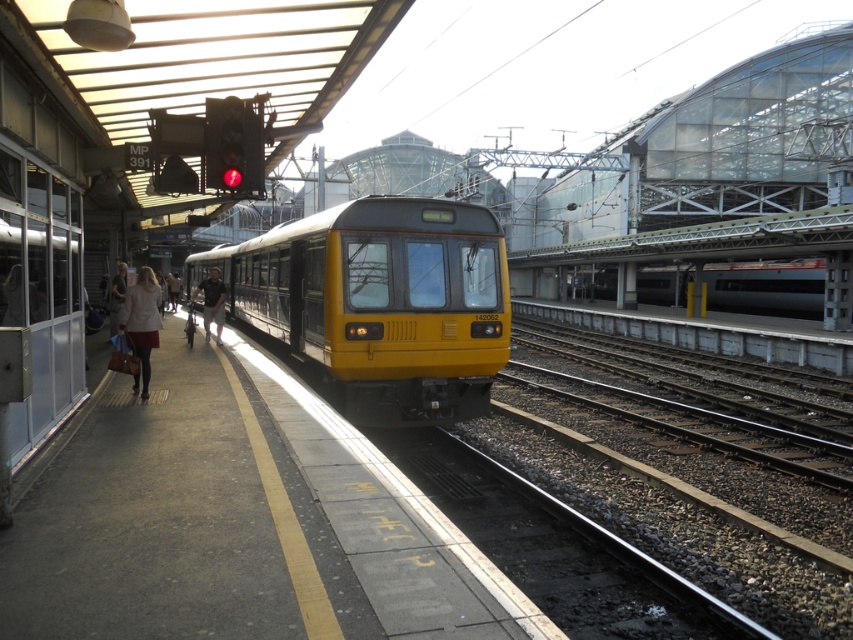
Question: Is silver metallic train at center above dark gray pants at left?

Choices:
 (A) yes
 (B) no

Answer: (A)

Question: Does yellow matte train at center appear on the right side of silver metallic train at center?

Choices:
 (A) no
 (B) yes

Answer: (A)

Question: Is yellow matte train at center bigger than matte beige jacket at left?

Choices:
 (A) yes
 (B) no

Answer: (A)

Question: Which object is the closest to the yellow matte train at center?

Choices:
 (A) dark gray pants at left
 (B) silver metallic train at center
 (C) matte beige jacket at left

Answer: (A)

Question: Which is nearer to the yellow matte train at center?

Choices:
 (A) silver metallic train at center
 (B) matte beige jacket at left
 (C) dark gray pants at left

Answer: (C)

Question: Estimate the real-world distances between objects in this image. Which object is farther from the matte beige jacket at left?

Choices:
 (A) yellow matte train at center
 (B) silver metallic train at center

Answer: (B)